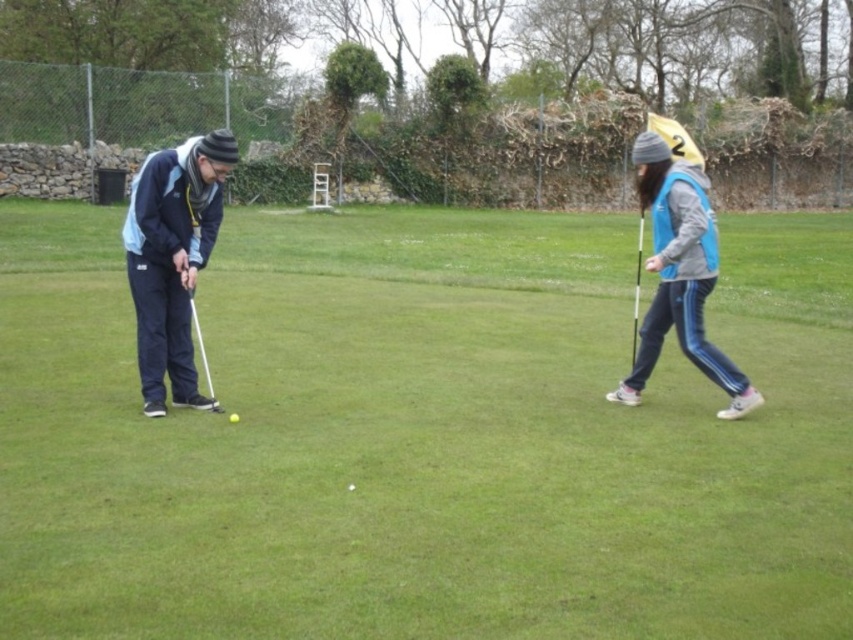
Identify the location of matte blue tracksuit at left. (173, 259).

Does matte blue tracksuit at left appear on the right side of white matte golf ball at center?

In fact, matte blue tracksuit at left is to the left of white matte golf ball at center.

The width and height of the screenshot is (853, 640). Find the location of `matte blue tracksuit at left`. matte blue tracksuit at left is located at coordinates (173, 259).

Who is more forward, (x=538, y=234) or (x=228, y=417)?

Point (x=228, y=417)

Measure the distance between green grass at center and camera.

green grass at center and camera are 3.99 meters apart from each other.

Measure the distance between green grass at center and camera.

A distance of 3.99 meters exists between green grass at center and camera.

The width and height of the screenshot is (853, 640). Find the location of `green grass at center`. green grass at center is located at coordinates (422, 435).

Which of these two, green grass at center or matte blue tracksuit at left, stands shorter?

With less height is matte blue tracksuit at left.

Between point (283, 483) and point (143, 388), which one is positioned behind?

Point (143, 388)

Who is more forward, (x=473, y=348) or (x=151, y=336)?

Point (x=151, y=336) is in front.

At what (x,y) coordinates should I click in order to perform the action: click on green grass at center. Please return your answer as a coordinate pair (x, y). This screenshot has width=853, height=640. Looking at the image, I should click on (422, 435).